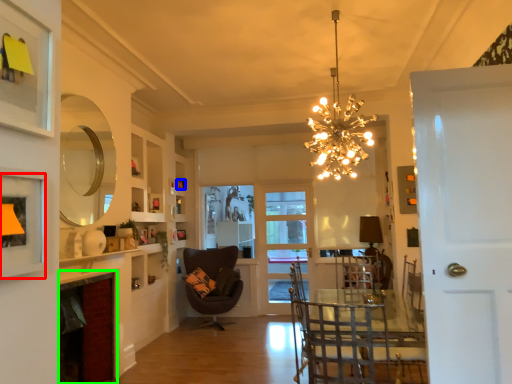
Question: Which object is the farthest from picture frame (highlighted by a red box)? Choose among these: picture frame (highlighted by a blue box) or fireplace (highlighted by a green box).

Choices:
 (A) picture frame
 (B) fireplace

Answer: (A)